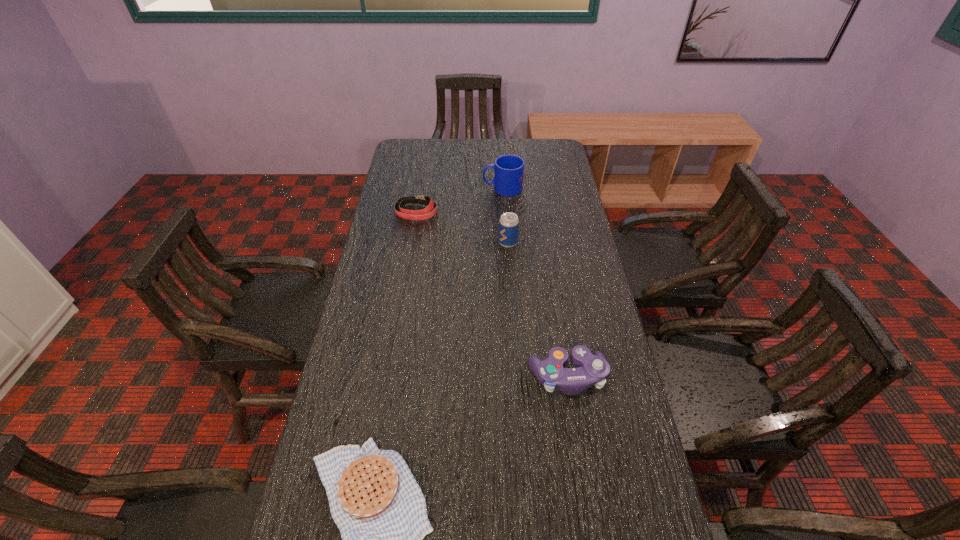
Find the location of a particular element. mug is located at coordinates (508, 169).

Find the location of `beer can`. beer can is located at coordinates (508, 223).

The width and height of the screenshot is (960, 540). In order to click on the third shortest object in this screenshot , I will do `click(593, 369)`.

Identify the location of control. (593, 369).

I want to click on the fourth nearest object, so click(x=423, y=214).

This screenshot has width=960, height=540. Find the location of `vacant space located 0.300m on the side with the handle of the mug`. vacant space located 0.300m on the side with the handle of the mug is located at coordinates [409, 188].

This screenshot has width=960, height=540. In order to click on vacant space situated on the side with the handle of the mug in this screenshot , I will do pyautogui.click(x=444, y=188).

Locate an element on the screen. Image resolution: width=960 pixels, height=540 pixels. free location located on the side with the handle of the mug is located at coordinates (404, 188).

The width and height of the screenshot is (960, 540). In order to click on vacant space located 0.180m on the front of the third farthest object in this screenshot , I will do `click(511, 286)`.

At what (x,y) coordinates should I click in order to perform the action: click on vacant space located on the front of the second nearest object. Please return your answer as a coordinate pair (x, y). This screenshot has height=540, width=960. Looking at the image, I should click on point(586,491).